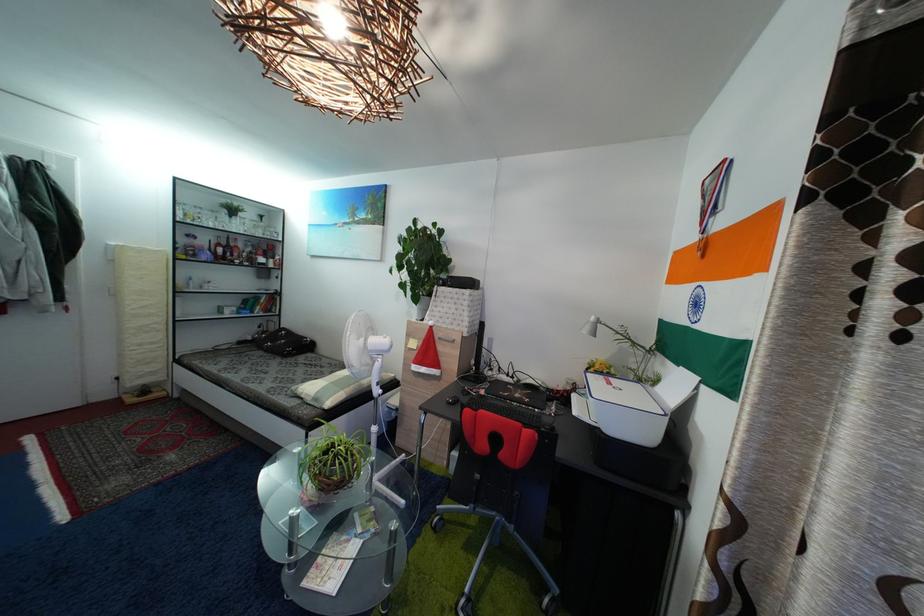
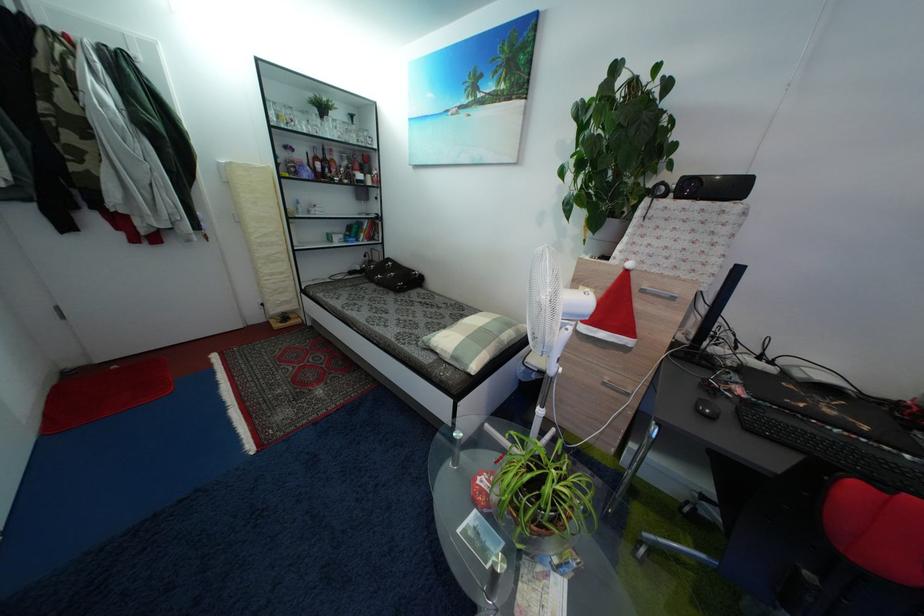
In a continuous first-person perspective shot, in which direction is the camera moving?

The cameraman walked toward left, forward.